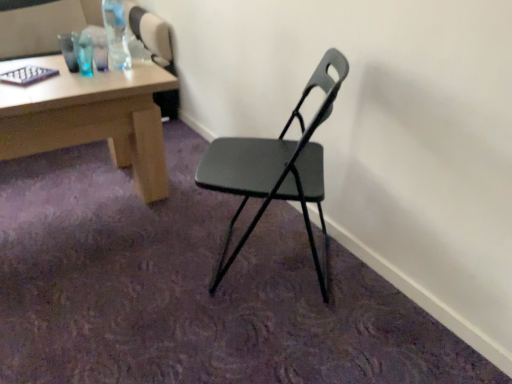
Where is `vacant space to the right of matte black chair at center`? vacant space to the right of matte black chair at center is located at coordinates (366, 294).